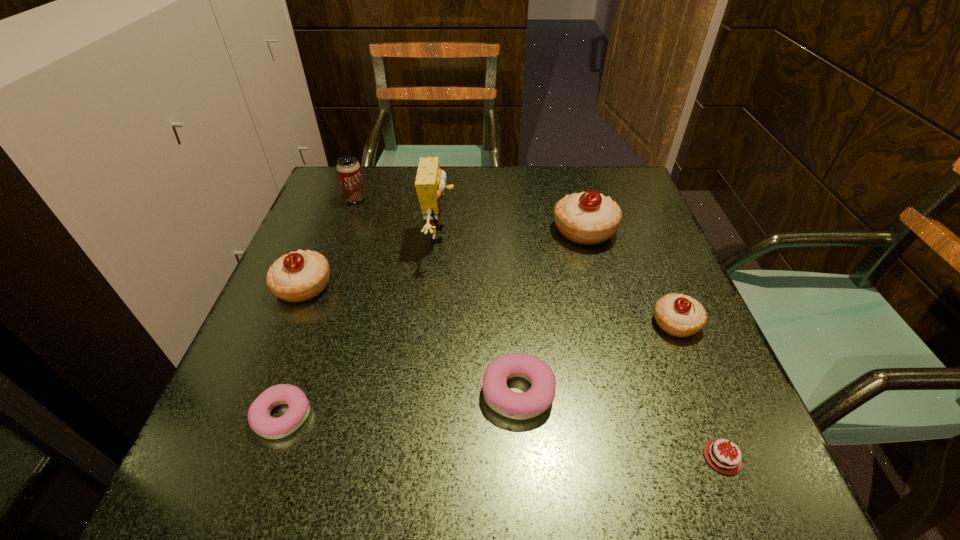
Identify the location of sponge. (430, 183).

I want to click on the tallest object, so click(430, 183).

The width and height of the screenshot is (960, 540). In order to click on the farthest beige pastry in this screenshot , I will do `click(588, 218)`.

At what (x,y) coordinates should I click in order to perform the action: click on the second beige pastry from left to right. Please return your answer as a coordinate pair (x, y). Looking at the image, I should click on (588, 218).

Identify the location of red beer can. The image size is (960, 540). (349, 171).

Locate an element on the screen. the fourth tallest object is located at coordinates (299, 276).

Find the location of a particular element. the second biggest beige pastry is located at coordinates (299, 276).

This screenshot has width=960, height=540. Identify the location of the rightmost pastry. (679, 315).

Locate an element on the screen. the third tallest pastry is located at coordinates (679, 315).

Find the location of a particular element. the right pink pastry is located at coordinates 529,404.